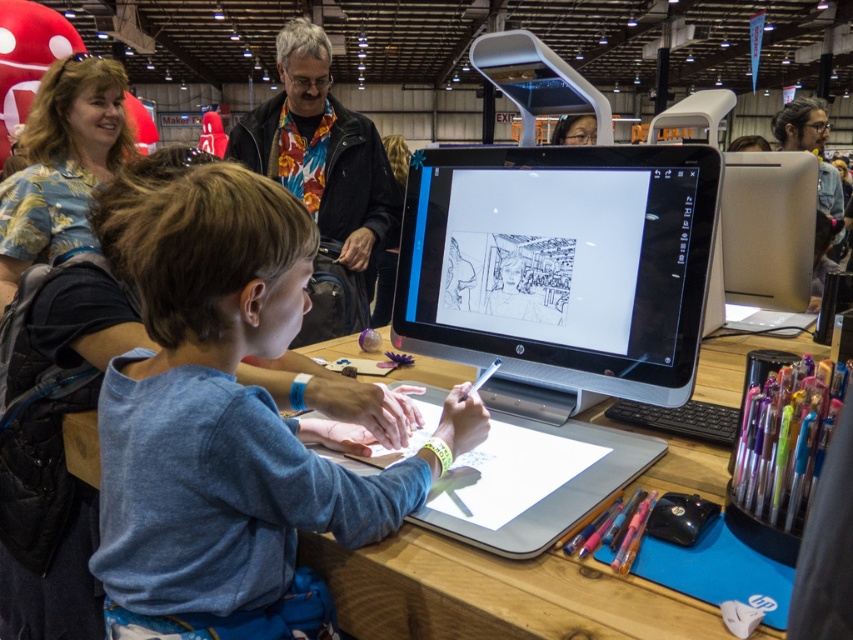
You are standing in the convention space and notice two points in the scene. The first point is at coordinates point (x=596, y=344) and the second is at point (x=102, y=88). Which point is closer to you?

Point (x=596, y=344) is closer to the viewer than point (x=102, y=88).

You are standing in the convention hall and see two points marked in the scene. Which point is closer to you, point [276,504] or point [65,67]?

Point [276,504] is in front of point [65,67], so it is closer to you.